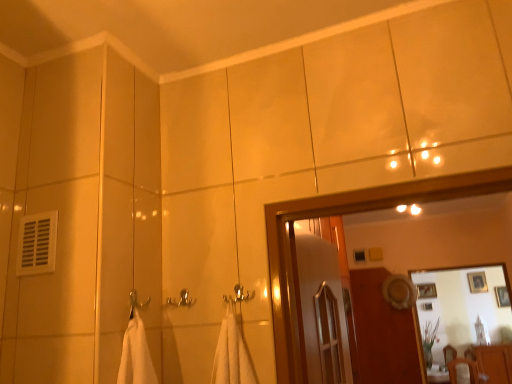
Question: From the image's perspective, is wooden framed picture at upper right, which appears as the second picture frame when viewed from the left, over silver metallic towel bar at center?

Choices:
 (A) no
 (B) yes

Answer: (A)

Question: Is wooden framed picture at upper right, which appears as the second picture frame when viewed from the left, at the left side of silver metallic towel bar at center?

Choices:
 (A) yes
 (B) no

Answer: (B)

Question: Is wooden framed picture at upper right, which is the first picture frame from right to left, positioned far away from silver metallic towel bar at center?

Choices:
 (A) no
 (B) yes

Answer: (B)

Question: Can you confirm if wooden framed picture at upper right, which appears as the second picture frame when viewed from the left, is shorter than silver metallic towel bar at center?

Choices:
 (A) yes
 (B) no

Answer: (B)

Question: Is wooden framed picture at upper right, which appears as the second picture frame when viewed from the left, behind silver metallic towel bar at center?

Choices:
 (A) no
 (B) yes

Answer: (B)

Question: Can you confirm if wooden framed picture at upper right, which is the first picture frame from right to left, is taller than silver metallic towel bar at center?

Choices:
 (A) yes
 (B) no

Answer: (A)

Question: From the image's perspective, is wooden screen door at center below wooden framed picture at upper right, which appears as the second picture frame when viewed from the left?

Choices:
 (A) no
 (B) yes

Answer: (A)

Question: Would you say wooden framed picture at upper right, which appears as the second picture frame when viewed from the left, is part of wooden screen door at center's contents?

Choices:
 (A) no
 (B) yes

Answer: (A)

Question: Is wooden screen door at center smaller than wooden framed picture at upper right, which is the first picture frame from right to left?

Choices:
 (A) yes
 (B) no

Answer: (B)

Question: Does wooden screen door at center turn towards wooden framed picture at upper right, which is the first picture frame from right to left?

Choices:
 (A) yes
 (B) no

Answer: (B)

Question: Is wooden screen door at center at the right side of wooden framed picture at upper right, which appears as the second picture frame when viewed from the left?

Choices:
 (A) yes
 (B) no

Answer: (B)

Question: From the image's perspective, would you say wooden screen door at center is positioned over wooden framed picture at upper right, which appears as the second picture frame when viewed from the left?

Choices:
 (A) no
 (B) yes

Answer: (B)

Question: Does wooden screen door at center have a greater height compared to glossy wooden mirror at upper center?

Choices:
 (A) yes
 (B) no

Answer: (B)